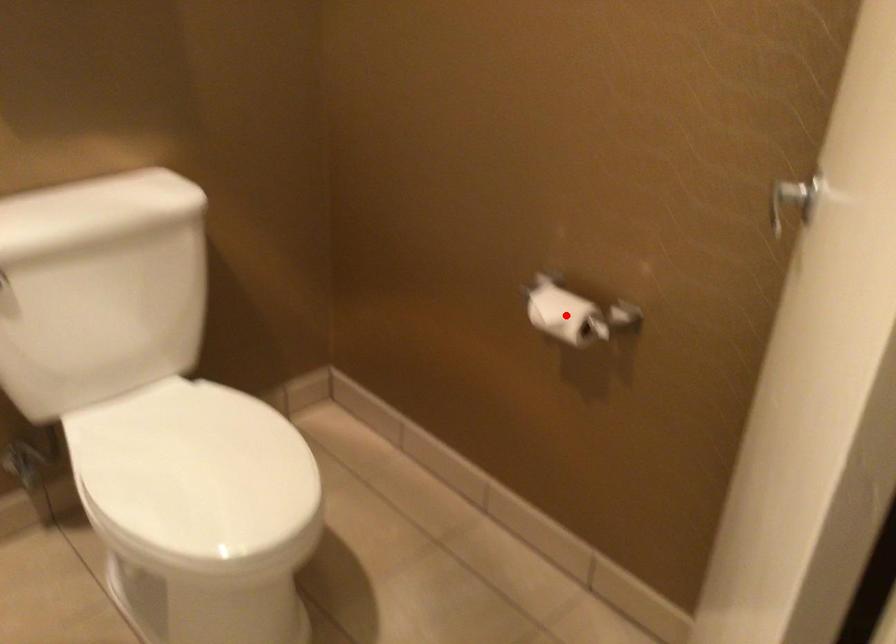
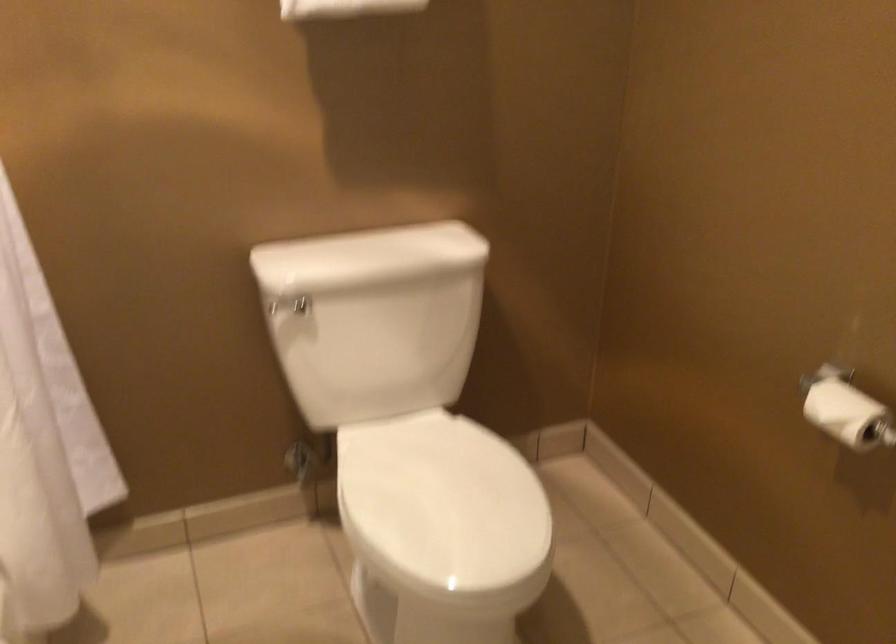
Question: I am providing you with two images of the same scene from different viewpoints. Image1 has a red point marked. In image2, the corresponding 3D location appears at what relative position? Reply with the corresponding letter.

Choices:
 (A) Closer
 (B) Farther

Answer: (A)